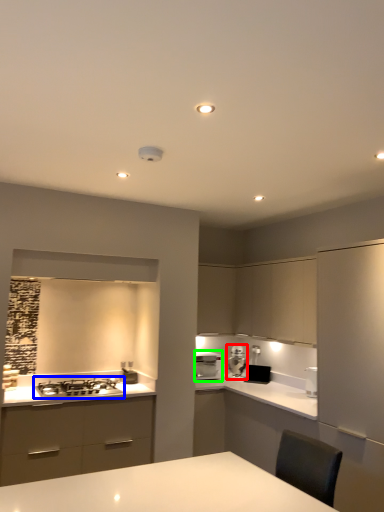
Question: Estimate the real-world distances between objects in this image. Which object is farther from kitchen appliance (highlighted by a red box), gas stove (highlighted by a blue box) or home appliance (highlighted by a green box)?

Choices:
 (A) gas stove
 (B) home appliance

Answer: (A)